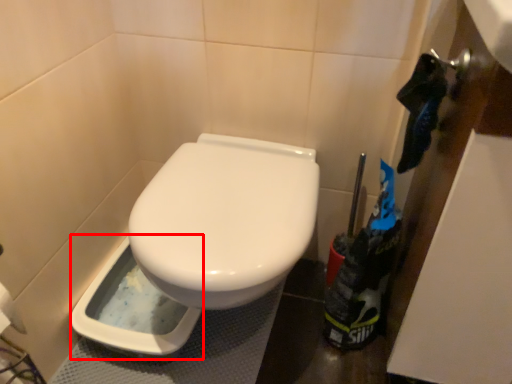
Question: From the image's perspective, where is bidet (annotated by the red box) located relative to garbage?

Choices:
 (A) above
 (B) below

Answer: (B)